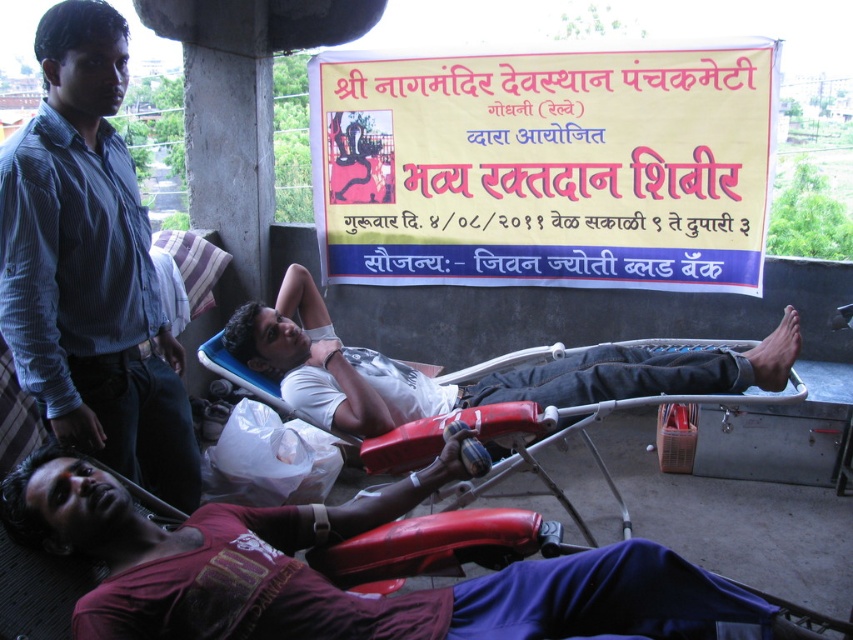
You are a photographer taking pictures of the blood donation event. You need to ensure that both the blue striped shirt at upper left and the red plastic stretcher at center are clearly visible in your shot. Given their positions, which object should you focus on first to ensure it doesn t get cropped out?

The blue striped shirt at upper left is taller than the red plastic stretcher at center, so you should focus on capturing the blue striped shirt at upper left first to ensure its full visibility in the frame.

You are organizing a blood donation event and need to arrange space for participants. Given the blue striped shirt at upper left and the red plastic stretcher at center, which object takes up more area in the image?

The red plastic stretcher at center occupies more space than the blue striped shirt at upper left, so it takes up more area in the image.